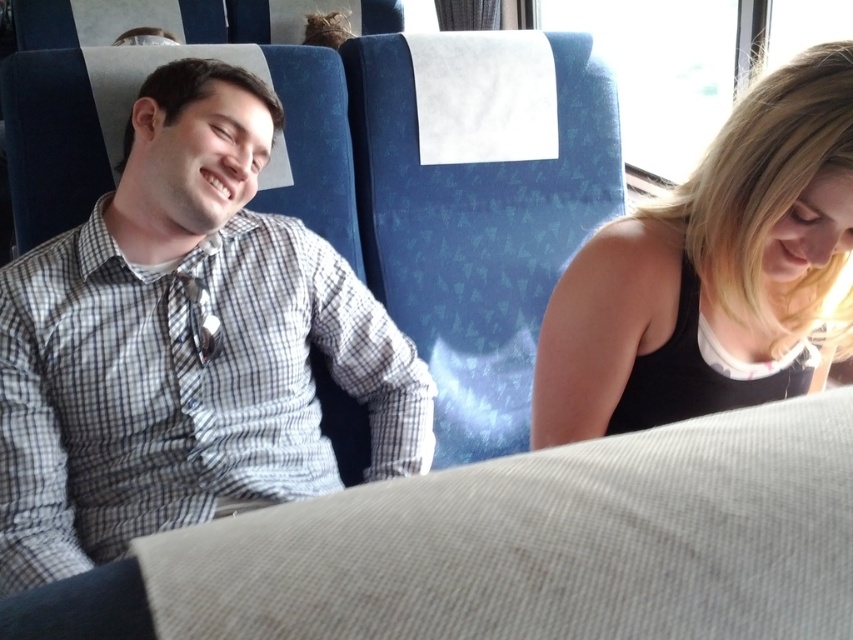
You are a photographer trying to capture a candid shot of both the checkered fabric shirt at left and the black tank top at right in the scene. Since you want both subjects to be in the frame, which direction should you position your camera relative to the subjects?

You should position your camera to the left of the subjects because the checkered fabric shirt at left is to the left of the black tank top at right, so placing the camera to the left would ensure both are in the frame.

You are a photographer standing in front of the two people in the image. You want to take a photo that clearly shows both the checkered fabric shirt at left and the black tank top at right. Which person should you focus on to ensure both are in sharp focus?

You should focus on the checkered fabric shirt at left because it is closer to you than the black tank top at right, so focusing on the closer one will keep both in focus.

In the scene shown: You are a photographer trying to capture both the checkered fabric shirt at left and the black tank top at right in a single frame. Since you want both shirts to appear similar in size in the photo, which direction should you move your camera? Explain your reasoning based on their sizes.

The checkered fabric shirt at left is larger in size than the black tank top at right. To make them appear similar in size, you should move the camera closer to the black tank top at right and farther from the checkered fabric shirt at left. This adjustment reduces the size of the larger shirt and enlarges the smaller tank top in the frame.